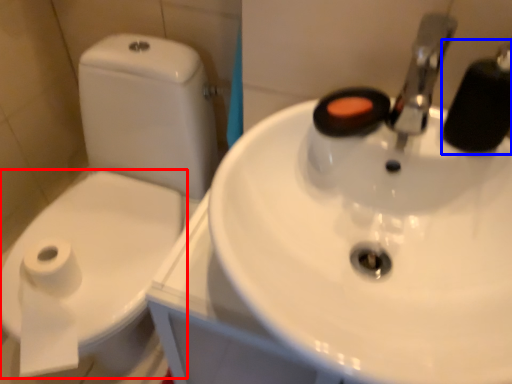
Question: Which object is closer to the camera taking this photo, bidet (highlighted by a red box) or plumbing fixture (highlighted by a blue box)?

Choices:
 (A) bidet
 (B) plumbing fixture

Answer: (B)